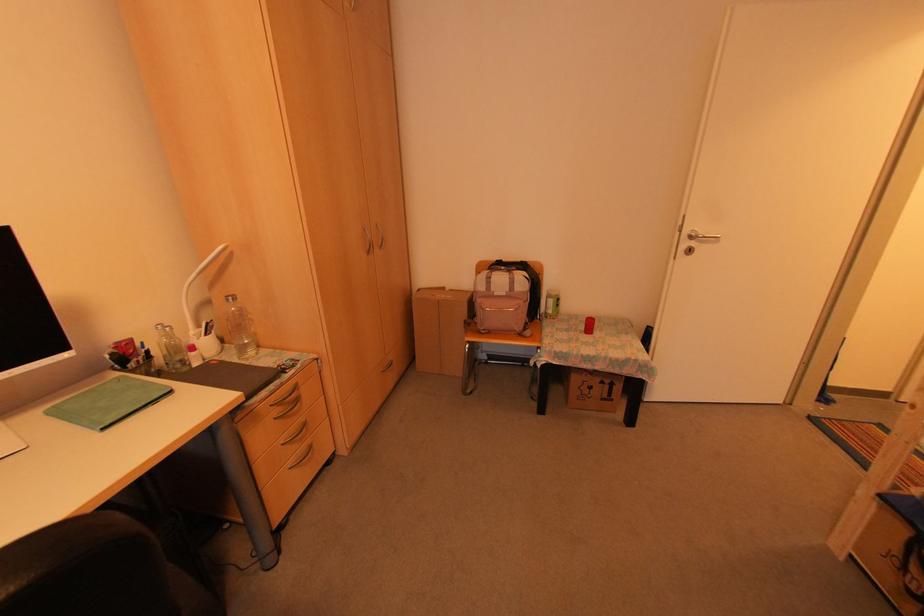
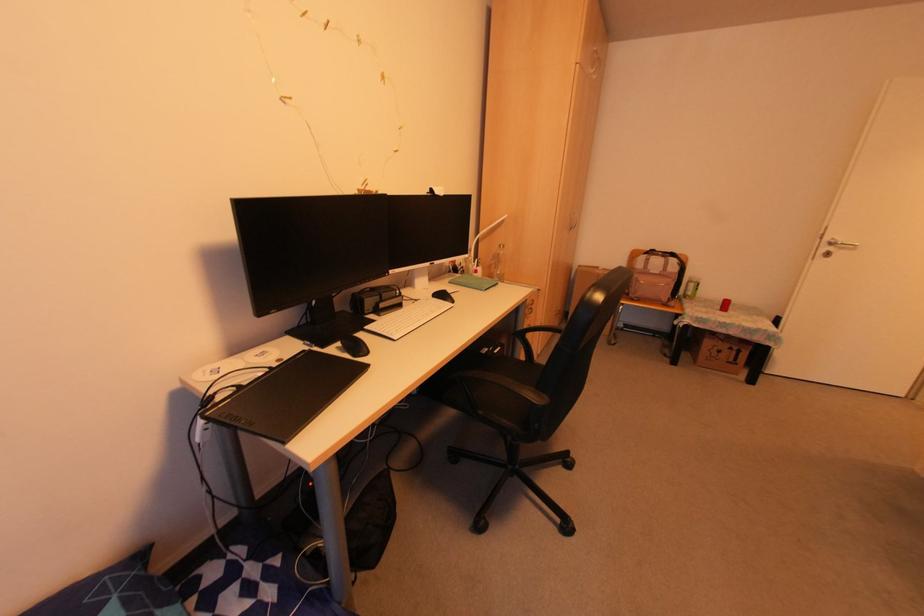
In the second image, find the point that corresponds to [598,381] in the first image.

(725, 346)